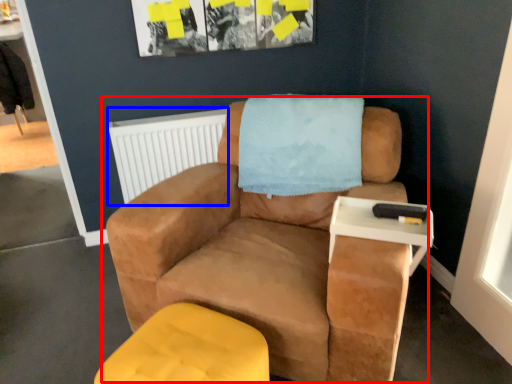
Question: Among these objects, which one is nearest to the camera, chair (highlighted by a red box) or radiator (highlighted by a blue box)?

Choices:
 (A) chair
 (B) radiator

Answer: (A)